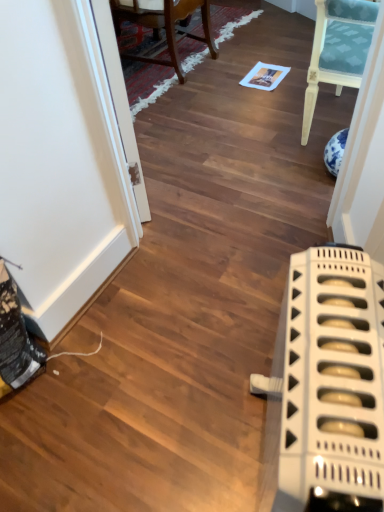
Question: Choose the correct answer: Is wooden chair at upper center inside white plastic radiator at lower right or outside it?

Choices:
 (A) outside
 (B) inside

Answer: (A)

Question: Relative to white plastic radiator at lower right, is wooden chair at upper center in front or behind?

Choices:
 (A) front
 (B) behind

Answer: (B)

Question: Which of these objects is positioned farthest from the wooden chair at upper center?

Choices:
 (A) white plastic radiator at lower right
 (B) transparent glass door at upper left

Answer: (A)

Question: Which of these objects is positioned closest to the white plastic radiator at lower right?

Choices:
 (A) wooden chair at upper center
 (B) transparent glass door at upper left

Answer: (B)